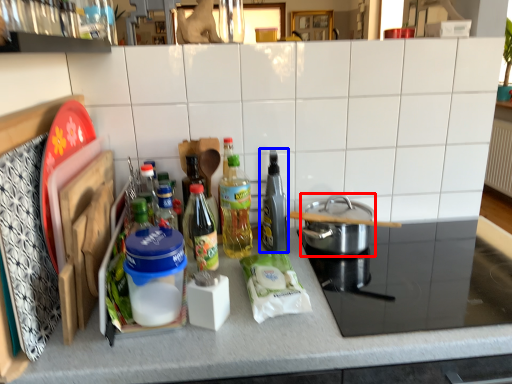
Question: Among these objects, which one is farthest to the camera, kitchen appliance (highlighted by a red box) or bottle (highlighted by a blue box)?

Choices:
 (A) kitchen appliance
 (B) bottle

Answer: (A)